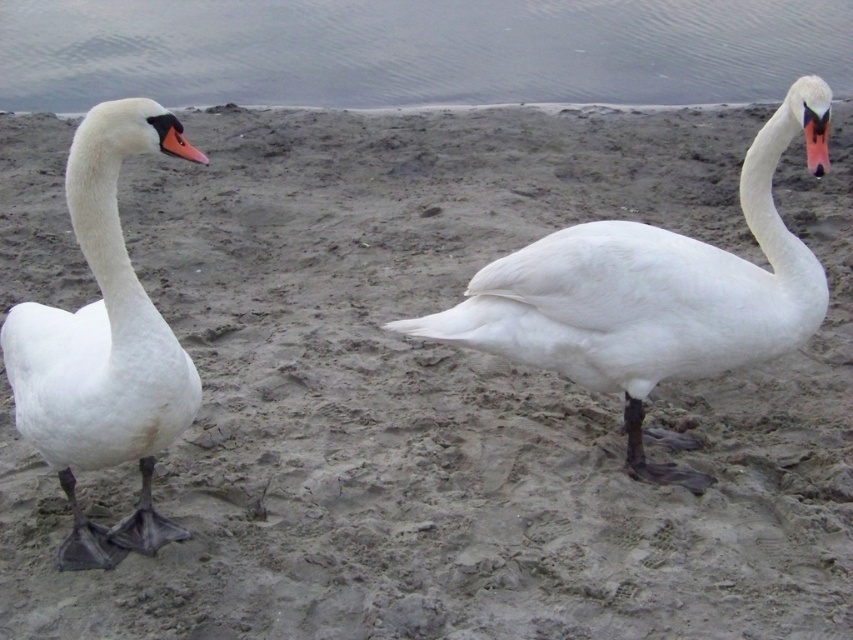
You are a wildlife photographer aiming to capture both the white matte swan at center and the matte orange beak at left in your shot. Since you want to ensure both are fully visible, which object will require more space in your camera frame?

The white matte swan at center requires more space in the camera frame because its width surpasses that of the matte orange beak at left.

You are a photographer trying to capture both swans in a single frame. Given that the white matte swan at left is at point 0.547, 0.121, where should you position your camera to ensure both swans are in focus?

The white matte swan at left is positioned at point (102, 349). To capture both swans in focus, position the camera so that the depth of field includes both the closer swan at the given coordinates and the farther swan on the right.

You are a photographer aiming to capture the white matte swan at center and the matte orange beak at left in your shot. Which object will appear taller in the photo?

The white matte swan at center will appear taller in the photo because it has a greater height compared to the matte orange beak at left.